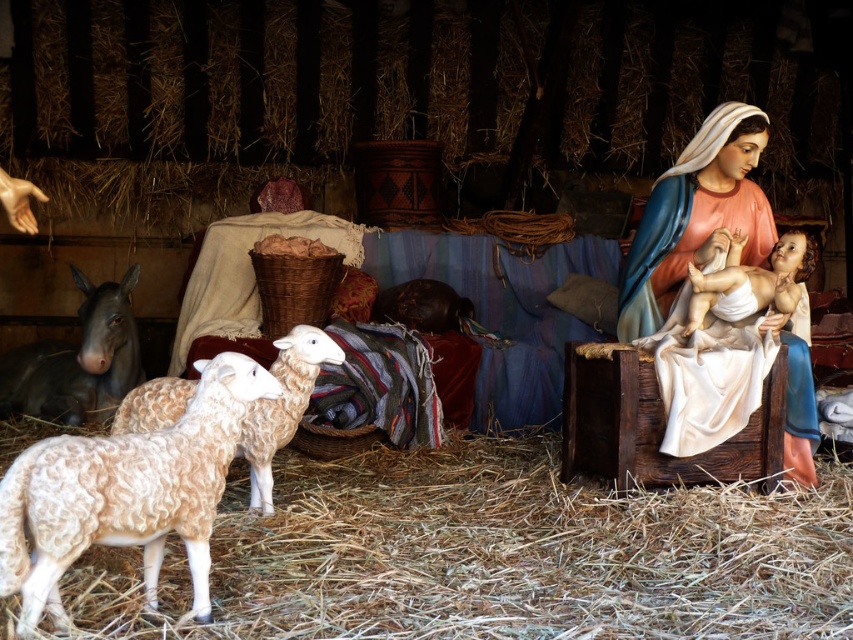
Is light brown woolen hay at lower center in front of fuzzy woolen sheep at lower left?

No.

Does light brown woolen hay at lower center have a larger size compared to fuzzy woolen sheep at lower left?

Yes, light brown woolen hay at lower center is bigger than fuzzy woolen sheep at lower left.

Between point (103, 625) and point (189, 472), which one is positioned behind?

Positioned behind is point (103, 625).

Find the location of a particular element. light brown woolen hay at lower center is located at coordinates click(x=523, y=552).

Is fuzzy woolen sheep at lower left smaller than matte porcelain statue at right?

Correct, fuzzy woolen sheep at lower left occupies less space than matte porcelain statue at right.

The height and width of the screenshot is (640, 853). What are the coordinates of `fuzzy woolen sheep at lower left` in the screenshot? It's located at (125, 492).

Is point (181, 429) positioned in front of point (265, 481)?

That is True.

Does fuzzy woolen sheep at lower left have a larger size compared to fluffy woolen sheep at center?

Incorrect, fuzzy woolen sheep at lower left is not larger than fluffy woolen sheep at center.

Does point (3, 492) come in front of point (241, 448)?

Yes.

The height and width of the screenshot is (640, 853). What are the coordinates of `fuzzy woolen sheep at lower left` in the screenshot? It's located at (125, 492).